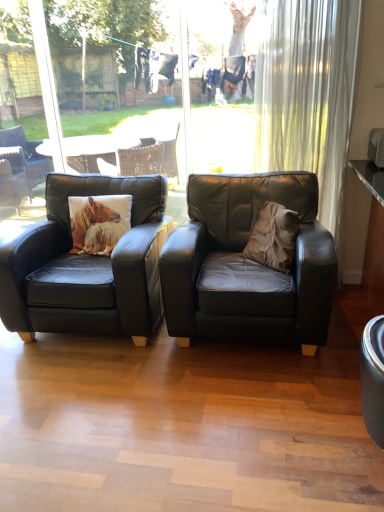
You are a GUI agent. You are given a task and a screenshot of the screen. Output one action in this format:
    pyautogui.click(x=<x>, y=<y>)
    Task: Click on the white textured pillow at left
    This screenshot has width=384, height=512.
    Given the screenshot: What is the action you would take?
    pyautogui.click(x=99, y=222)

The image size is (384, 512). In order to click on transparent glass window at center in this screenshot , I will do `click(48, 86)`.

Considering the relative positions of brown suede throw pillow at center and black leather chair at center, which appears as the second chair when viewed from the right, in the image provided, is brown suede throw pillow at center to the right of black leather chair at center, which appears as the second chair when viewed from the right, from the viewer's perspective?

Yes.

Is brown suede throw pillow at center turned away from black leather chair at center, which appears as the second chair when viewed from the right?

brown suede throw pillow at center is not turned away from black leather chair at center, which appears as the second chair when viewed from the right.

I want to click on throw pillow that appears above the black leather chair at center, which appears as the second chair when viewed from the right (from the image's perspective), so click(273, 237).

In terms of width, does matte black armchair at center, the second chair when ordered from left to right, look wider or thinner when compared to brown suede throw pillow at center?

Considering their sizes, matte black armchair at center, the second chair when ordered from left to right, looks broader than brown suede throw pillow at center.

Could you tell me if matte black armchair at center, the second chair when ordered from left to right, is facing brown suede throw pillow at center?

Yes, matte black armchair at center, the second chair when ordered from left to right, is turned towards brown suede throw pillow at center.

Is matte black armchair at center, the first chair viewed from the right, taller than brown suede throw pillow at center?

Indeed, matte black armchair at center, the first chair viewed from the right, has a greater height compared to brown suede throw pillow at center.

Which object is further away from the camera taking this photo, matte black armchair at center, the first chair viewed from the right, or brown suede throw pillow at center?

Positioned behind is brown suede throw pillow at center.

How different are the orientations of transparent glass window at center and brown suede throw pillow at center in degrees?

52.5 degrees.

You are a GUI agent. You are given a task and a screenshot of the screen. Output one action in this format:
    pyautogui.click(x=<x>, y=<y>)
    Task: Click on the throw pillow below the transparent glass window at center (from a real-world perspective)
    The height and width of the screenshot is (512, 384).
    Given the screenshot: What is the action you would take?
    pyautogui.click(x=273, y=237)

Based on their positions, is transparent glass window at center located to the left or right of brown suede throw pillow at center?

transparent glass window at center is positioned on brown suede throw pillow at center's left side.

In the scene shown: Between transparent glass window at center and brown suede throw pillow at center, which one has less height?

With less height is brown suede throw pillow at center.

Is black leather chair at center, which appears as the second chair when viewed from the right, with matte black armchair at center, the second chair when ordered from left to right?

No, black leather chair at center, which appears as the second chair when viewed from the right, is not making contact with matte black armchair at center, the second chair when ordered from left to right.

Which point is more distant from viewer, (75, 272) or (313, 190)?

Point (313, 190)

Where is `chair located on the right of black leather chair at center, placed as the first chair when sorted from left to right`? The height and width of the screenshot is (512, 384). chair located on the right of black leather chair at center, placed as the first chair when sorted from left to right is located at coordinates coord(247,265).

Considering the relative positions of black leather chair at center, which appears as the second chair when viewed from the right, and matte black armchair at center, the second chair when ordered from left to right, in the image provided, is black leather chair at center, which appears as the second chair when viewed from the right, to the left or to the right of matte black armchair at center, the second chair when ordered from left to right,?

In the image, black leather chair at center, which appears as the second chair when viewed from the right, appears on the left side of matte black armchair at center, the second chair when ordered from left to right.

In the scene shown: Is white textured pillow at left at the right side of white sheer curtain at upper right?

No.

From the image's perspective, relative to white sheer curtain at upper right, is white textured pillow at left above or below?

white textured pillow at left is situated lower than white sheer curtain at upper right in the image.

Which object is further away from the camera, white textured pillow at left or white sheer curtain at upper right?

white textured pillow at left.

From a real-world perspective, relative to black leather chair at center, placed as the first chair when sorted from left to right, is white sheer curtain at upper right vertically above or below?

Clearly, from a real-world perspective, white sheer curtain at upper right is above black leather chair at center, placed as the first chair when sorted from left to right.

Would you say white sheer curtain at upper right is to the left or to the right of black leather chair at center, which appears as the second chair when viewed from the right, in the picture?

white sheer curtain at upper right is to the right of black leather chair at center, which appears as the second chair when viewed from the right.

Is white sheer curtain at upper right with black leather chair at center, placed as the first chair when sorted from left to right?

No, white sheer curtain at upper right is not beside black leather chair at center, placed as the first chair when sorted from left to right.

Is white sheer curtain at upper right facing away from black leather chair at center, which appears as the second chair when viewed from the right?

No, black leather chair at center, which appears as the second chair when viewed from the right, is not at the back of white sheer curtain at upper right.

In the image, is white textured pillow at left positioned in front of or behind transparent glass window at center?

Visually, white textured pillow at left is located in front of transparent glass window at center.

Does white textured pillow at left turn towards transparent glass window at center?

No.

Based on the photo, would you consider white textured pillow at left to be distant from transparent glass window at center?

No, white textured pillow at left is not far from transparent glass window at center.

Locate an element on the screen. The width and height of the screenshot is (384, 512). throw pillow above the black leather chair at center, which appears as the second chair when viewed from the right (from a real-world perspective) is located at coordinates (273, 237).

From a real-world perspective, starting from the brown suede throw pillow at center, which chair is the 2nd one below it? Please provide its 2D coordinates.

[(247, 265)]

From the image, which object appears to be farther from black leather chair at center, placed as the first chair when sorted from left to right, matte black armchair at center, the first chair viewed from the right, or white textured pillow at left?

matte black armchair at center, the first chair viewed from the right, is positioned further to the anchor black leather chair at center, placed as the first chair when sorted from left to right.

From the image, which object appears to be nearer to brown suede throw pillow at center, black leather chair at center, placed as the first chair when sorted from left to right, or white textured pillow at left?

black leather chair at center, placed as the first chair when sorted from left to right, lies closer to brown suede throw pillow at center than the other object.

From the image, which object appears to be nearer to matte black armchair at center, the first chair viewed from the right, white textured pillow at left or black leather chair at center, placed as the first chair when sorted from left to right?

black leather chair at center, placed as the first chair when sorted from left to right.

Which object lies nearer to the anchor point white textured pillow at left, brown suede throw pillow at center or matte black armchair at center, the first chair viewed from the right?

The object closer to white textured pillow at left is matte black armchair at center, the first chair viewed from the right.

From the image, which object appears to be nearer to black leather chair at center, which appears as the second chair when viewed from the right, white sheer curtain at upper right or matte black armchair at center, the first chair viewed from the right?

matte black armchair at center, the first chair viewed from the right, is positioned closer to the anchor black leather chair at center, which appears as the second chair when viewed from the right.

From the image, which object appears to be nearer to transparent glass window at center, matte black armchair at center, the second chair when ordered from left to right, or black leather chair at center, which appears as the second chair when viewed from the right?

Among the two, black leather chair at center, which appears as the second chair when viewed from the right, is located nearer to transparent glass window at center.

Considering their positions, is white textured pillow at left positioned further to brown suede throw pillow at center than matte black armchair at center, the second chair when ordered from left to right?

white textured pillow at left is further to brown suede throw pillow at center.

Which object lies nearer to the anchor point white textured pillow at left, white sheer curtain at upper right or transparent glass window at center?

transparent glass window at center is positioned closer to the anchor white textured pillow at left.

Locate an element on the screen. This screenshot has height=512, width=384. pillow between transparent glass window at center and black leather chair at center, placed as the first chair when sorted from left to right, in the up-down direction is located at coordinates (99, 222).

Where is `chair situated between white textured pillow at left and brown suede throw pillow at center from left to right`? The width and height of the screenshot is (384, 512). chair situated between white textured pillow at left and brown suede throw pillow at center from left to right is located at coordinates (247, 265).

You are a GUI agent. You are given a task and a screenshot of the screen. Output one action in this format:
    pyautogui.click(x=<x>, y=<y>)
    Task: Click on the throw pillow between transparent glass window at center and white sheer curtain at upper right in the horizontal direction
    The height and width of the screenshot is (512, 384).
    Given the screenshot: What is the action you would take?
    pyautogui.click(x=273, y=237)

Image resolution: width=384 pixels, height=512 pixels. I want to click on window screen between black leather chair at center, which appears as the second chair when viewed from the right, and white sheer curtain at upper right, so click(48, 86).